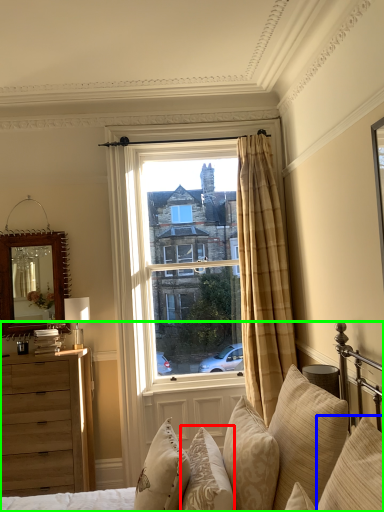
Question: Estimate the real-world distances between objects in this image. Which object is closer to pillow (highlighted by a red box), pillow (highlighted by a blue box) or studio couch (highlighted by a green box)?

Choices:
 (A) pillow
 (B) studio couch

Answer: (B)